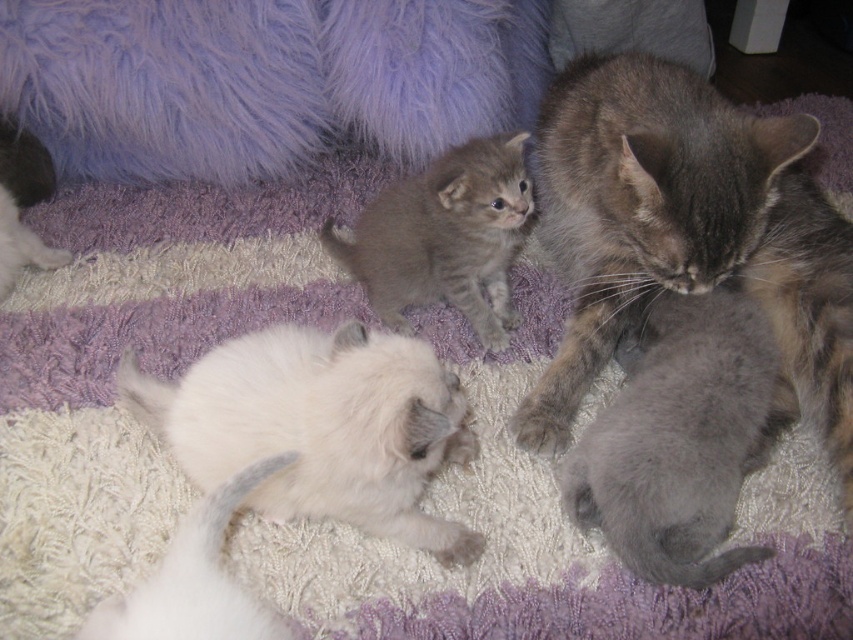
Question: Is purple fluffy blanket at upper left positioned behind white fluffy tail at lower left?

Choices:
 (A) yes
 (B) no

Answer: (A)

Question: Is purple fluffy blanket at upper left positioned before gray fluffy kitten at center?

Choices:
 (A) yes
 (B) no

Answer: (B)

Question: Which of the following is the closest to the observer?

Choices:
 (A) white fluffy tail at lower left
 (B) white fluffy kitten at lower left
 (C) purple fluffy blanket at upper left

Answer: (A)

Question: Observing the image, what is the correct spatial positioning of white fluffy kitten at lower left in reference to white fur cat at upper left?

Choices:
 (A) right
 (B) left

Answer: (A)

Question: Which point is closer to the camera taking this photo?

Choices:
 (A) (695, 280)
 (B) (325, 381)
 (C) (670, 500)
 (D) (381, 216)

Answer: (B)

Question: Which of the following is the farthest from the observer?

Choices:
 (A) (589, 428)
 (B) (323, 509)
 (C) (386, 45)

Answer: (C)